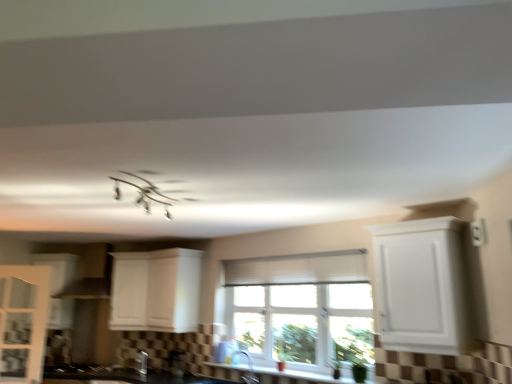
In order to click on white matte cabinet at center, the fourth cabinetry from the left in this screenshot , I will do `click(156, 290)`.

Describe the element at coordinates (298, 269) in the screenshot. I see `white pleated blind at center` at that location.

Describe the element at coordinates (57, 268) in the screenshot. I see `white glossy cabinet at left, which is the fifth cabinetry in right-to-left order` at that location.

The height and width of the screenshot is (384, 512). What are the coordinates of `white ceramic window sill at lower center` in the screenshot? It's located at (294, 377).

Is white matte cabinet at center, which appears as the 3th cabinetry when viewed from the right, completely or partially inside white glossy cabinet at left, placed as the 2th cabinetry when sorted from left to right?

No, white matte cabinet at center, which appears as the 3th cabinetry when viewed from the right, is not a part of white glossy cabinet at left, placed as the 2th cabinetry when sorted from left to right.

Which of these two, white glossy cabinet at left, the 4th cabinetry in the right-to-left sequence, or white matte cabinet at center, which appears as the 3th cabinetry when viewed from the right, is wider?

Wider between the two is white matte cabinet at center, which appears as the 3th cabinetry when viewed from the right.

Where is `the 1st cabinetry counting from the left side of the white matte cabinet at center, which appears as the 3th cabinetry when viewed from the right`? Image resolution: width=512 pixels, height=384 pixels. the 1st cabinetry counting from the left side of the white matte cabinet at center, which appears as the 3th cabinetry when viewed from the right is located at coordinates (23, 320).

Is white glossy cabinet at left, placed as the 2th cabinetry when sorted from left to right, directly adjacent to white matte cabinet at center, the third cabinetry when ordered from left to right?

No, white glossy cabinet at left, placed as the 2th cabinetry when sorted from left to right, is not making contact with white matte cabinet at center, the third cabinetry when ordered from left to right.

How different are the orientations of black glossy countertop at lower center and white glossy cabinet at left, the 1th cabinetry when ordered from left to right, in degrees?

There is a 34.2-degree angle between the facing directions of black glossy countertop at lower center and white glossy cabinet at left, the 1th cabinetry when ordered from left to right.

Where is `the 4th cabinetry behind the black glossy countertop at lower center`? The height and width of the screenshot is (384, 512). the 4th cabinetry behind the black glossy countertop at lower center is located at coordinates (57, 268).

Is the depth of black glossy countertop at lower center greater than that of white glossy cabinet at left, the 1th cabinetry when ordered from left to right?

No, black glossy countertop at lower center is closer to the viewer.

From a real-world perspective, is white plastic window at center over white matte cabinet at center, arranged as the 2th cabinetry when viewed from the right?

No, from a real-world perspective, white plastic window at center is not over white matte cabinet at center, arranged as the 2th cabinetry when viewed from the right

Does white plastic window at center lie behind white matte cabinet at center, the fourth cabinetry from the left?

No, white plastic window at center is in front of white matte cabinet at center, the fourth cabinetry from the left.

Is white plastic window at center spatially inside white matte cabinet at center, the fourth cabinetry from the left, or outside of it?

white plastic window at center is located beyond the bounds of white matte cabinet at center, the fourth cabinetry from the left.

Is point (234, 355) closer to camera compared to point (44, 333)?

No, it is behind (44, 333).

At what (x,y) coordinates should I click in order to perform the action: click on faucet in front of the white glossy cabinet at left, the 4th cabinetry in the right-to-left sequence. Please return your answer as a coordinate pair (x, y). Image resolution: width=512 pixels, height=384 pixels. Looking at the image, I should click on (249, 368).

Consider the image. Can you tell me how much satin nickel faucet at lower center and white glossy cabinet at left, the 4th cabinetry in the right-to-left sequence, differ in facing direction?

21.7 degrees separate the facing orientations of satin nickel faucet at lower center and white glossy cabinet at left, the 4th cabinetry in the right-to-left sequence.

Which object is thinner, satin nickel faucet at lower center or white glossy cabinet at left, placed as the 2th cabinetry when sorted from left to right?

white glossy cabinet at left, placed as the 2th cabinetry when sorted from left to right.

Is black glossy countertop at lower center positioned with its back to black matte gas stove at lower left?

No, black matte gas stove at lower left is not at the back of black glossy countertop at lower center.

Does black glossy countertop at lower center have a smaller size compared to black matte gas stove at lower left?

No.

Is black glossy countertop at lower center at the right side of black matte gas stove at lower left?

Yes, black glossy countertop at lower center is to the right of black matte gas stove at lower left.

Who is more distant, black glossy countertop at lower center or black matte gas stove at lower left?

black matte gas stove at lower left.

In the scene shown: From the image's perspective, is black glossy countertop at lower center located above white matte cabinet at center, arranged as the 2th cabinetry when viewed from the right?

Incorrect, from the image's perspective, black glossy countertop at lower center is lower than white matte cabinet at center, arranged as the 2th cabinetry when viewed from the right.

Is black glossy countertop at lower center positioned beyond the bounds of white matte cabinet at center, the fourth cabinetry from the left?

Yes, black glossy countertop at lower center is located beyond the bounds of white matte cabinet at center, the fourth cabinetry from the left.

Does black glossy countertop at lower center have a larger size compared to white matte cabinet at center, the fourth cabinetry from the left?

Yes, black glossy countertop at lower center is bigger than white matte cabinet at center, the fourth cabinetry from the left.

Relative to white matte cabinet at center, the fourth cabinetry from the left, is black glossy countertop at lower center in front or behind?

In the image, black glossy countertop at lower center appears in front of white matte cabinet at center, the fourth cabinetry from the left.

Is point (131, 273) more distant than point (94, 377)?

Yes, point (131, 273) is farther from viewer.

Are white matte cabinet at center, which appears as the 3th cabinetry when viewed from the right, and black matte gas stove at lower left far apart?

white matte cabinet at center, which appears as the 3th cabinetry when viewed from the right, is actually quite close to black matte gas stove at lower left.

Who is bigger, white matte cabinet at center, the third cabinetry when ordered from left to right, or black matte gas stove at lower left?

With larger size is white matte cabinet at center, the third cabinetry when ordered from left to right.

Find the location of a particular element. cabinetry that is the 2nd object located below the white matte cabinet at center, the third cabinetry when ordered from left to right (from the image's perspective) is located at coordinates coord(23,320).

This screenshot has height=384, width=512. Find the location of `countertop on the right of the white glossy cabinet at left, which is the fifth cabinetry in right-to-left order`. countertop on the right of the white glossy cabinet at left, which is the fifth cabinetry in right-to-left order is located at coordinates (123, 375).

Estimate the real-world distances between objects in this image. Which object is closer to white glossy cabinet at left, which is the fifth cabinetry in right-to-left order, black matte gas stove at lower left or white matte cabinet at right, the 5th cabinetry from the left?

black matte gas stove at lower left is closer to white glossy cabinet at left, which is the fifth cabinetry in right-to-left order.

From the image, which object appears to be farther from white plastic window at center, white matte cabinet at center, the fourth cabinetry from the left, or satin silver toaster at lower center, the 2th appliance from the right?

satin silver toaster at lower center, the 2th appliance from the right, is positioned further to the anchor white plastic window at center.

Considering their positions, is white pleated blind at center positioned further to white matte cabinet at right, the 5th cabinetry from the left, than black glossy countertop at lower center?

black glossy countertop at lower center.

When comparing their distances from white matte cabinet at center, the third cabinetry when ordered from left to right, does white matte cabinet at center, arranged as the 2th cabinetry when viewed from the right, or white pleated blind at center seem closer?

The object closer to white matte cabinet at center, the third cabinetry when ordered from left to right, is white matte cabinet at center, arranged as the 2th cabinetry when viewed from the right.

Looking at the image, which one is located closer to black glossy countertop at lower center, white matte cabinet at center, the fourth cabinetry from the left, or satin nickel faucet at lower center?

Among the two, white matte cabinet at center, the fourth cabinetry from the left, is located nearer to black glossy countertop at lower center.

Estimate the real-world distances between objects in this image. Which object is closer to white glossy cabinet at left, the 4th cabinetry in the right-to-left sequence, satin nickel faucet at lower center or white matte cabinet at center, which appears as the 3th cabinetry when viewed from the right?

white matte cabinet at center, which appears as the 3th cabinetry when viewed from the right, is positioned closer to the anchor white glossy cabinet at left, the 4th cabinetry in the right-to-left sequence.

Looking at the image, which one is located further to satin nickel faucet at lower center, black glossy countertop at lower center or white matte cabinet at center, the third cabinetry when ordered from left to right?

Among the two, white matte cabinet at center, the third cabinetry when ordered from left to right, is located further to satin nickel faucet at lower center.

Based on their spatial positions, is white pleated blind at center or white matte cabinet at center, arranged as the 2th cabinetry when viewed from the right, further from black glossy countertop at lower center?

Among the two, white pleated blind at center is located further to black glossy countertop at lower center.

You are a GUI agent. You are given a task and a screenshot of the screen. Output one action in this format:
    pyautogui.click(x=<x>, y=<y>)
    Task: Click on the countertop between black matte gas stove at lower left and white plastic window at center
    The width and height of the screenshot is (512, 384).
    Given the screenshot: What is the action you would take?
    pyautogui.click(x=123, y=375)

The image size is (512, 384). In order to click on faucet between white matte cabinet at center, the third cabinetry when ordered from left to right, and white plastic window at center from left to right in this screenshot , I will do `click(249, 368)`.

At what (x,y) coordinates should I click in order to perform the action: click on window sill located between satin silver toaster at lower center, the 2th appliance from the right, and white matte cabinet at right, the 5th cabinetry from the left, in the left-right direction. Please return your answer as a coordinate pair (x, y). This screenshot has width=512, height=384. Looking at the image, I should click on (294, 377).

The width and height of the screenshot is (512, 384). I want to click on window sill between white matte cabinet at center, the fourth cabinetry from the left, and white matte cabinet at right, the 5th cabinetry from the left, in the horizontal direction, so click(294, 377).